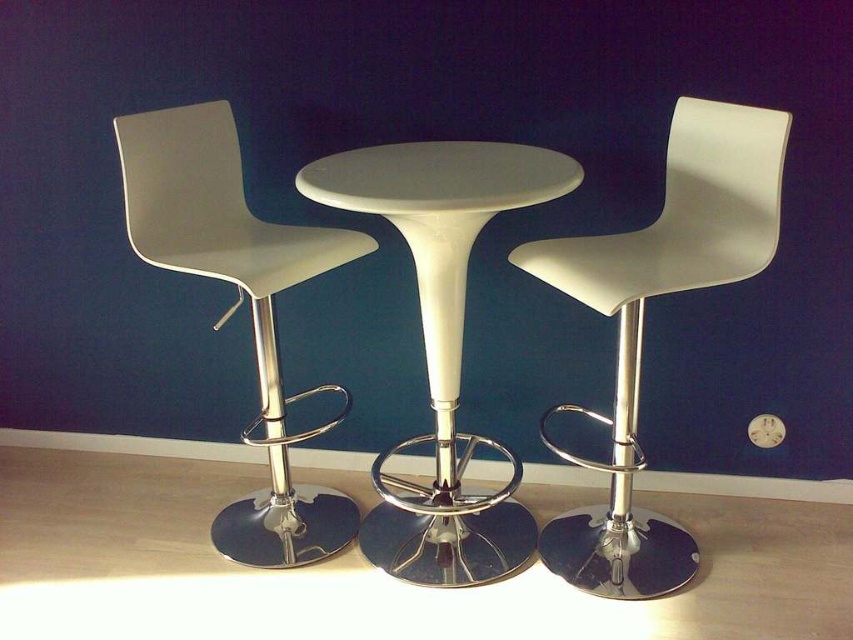
Who is more forward, (616, 580) or (259, 257)?

Point (259, 257) is more forward.

Is point (552, 410) behind point (230, 120)?

Yes, it is.

Locate an element on the screen. The width and height of the screenshot is (853, 640). white matte chair at center is located at coordinates (642, 321).

Who is higher up, white matte chair at center or white glossy table at center?

white matte chair at center

Is point (660, 234) closer to camera compared to point (419, 496)?

Yes, it is.

Who is more forward, (634, 314) or (407, 173)?

Point (407, 173) is more forward.

Where is `white matte chair at center`? This screenshot has height=640, width=853. white matte chair at center is located at coordinates (642, 321).

Who is taller, white glossy table at center or white matte bar stool at left?

white matte bar stool at left

Between white glossy table at center and white matte bar stool at left, which one has less height?

white glossy table at center

You are a GUI agent. You are given a task and a screenshot of the screen. Output one action in this format:
    pyautogui.click(x=<x>, y=<y>)
    Task: Click on the white glossy table at center
    
    Given the screenshot: What is the action you would take?
    [x=442, y=340]

The width and height of the screenshot is (853, 640). What are the coordinates of `white glossy table at center` in the screenshot? It's located at (442, 340).